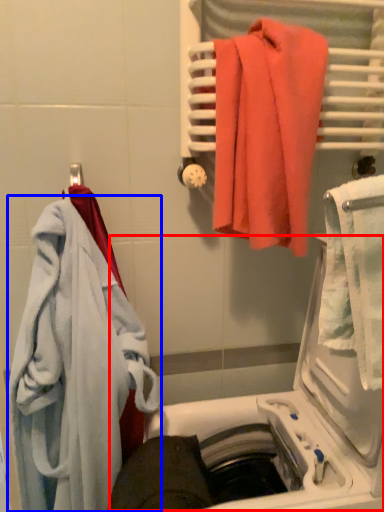
Question: Which point is closer to the camera, dish washer (highlighted by a red box) or towel (highlighted by a blue box)?

Choices:
 (A) dish washer
 (B) towel

Answer: (A)